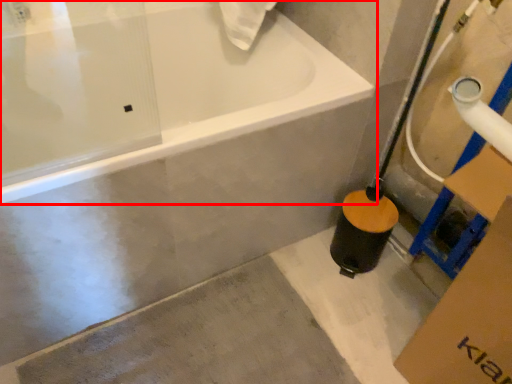
Question: In this image, where is bathtub (annotated by the red box) located relative to concrete?

Choices:
 (A) right
 (B) left

Answer: (B)